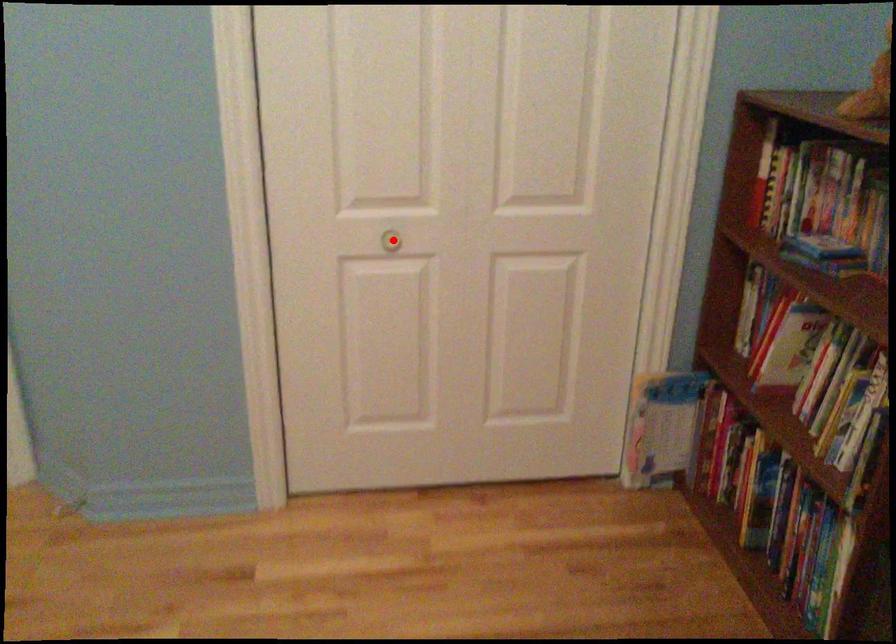
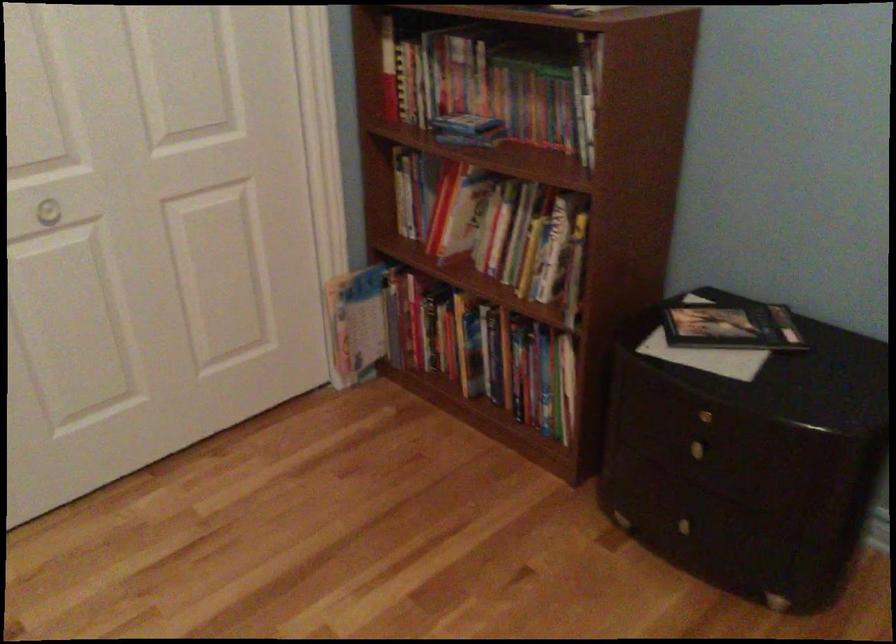
Find the pixel in the second image that matches the highlighted location in the first image.

(47, 212)